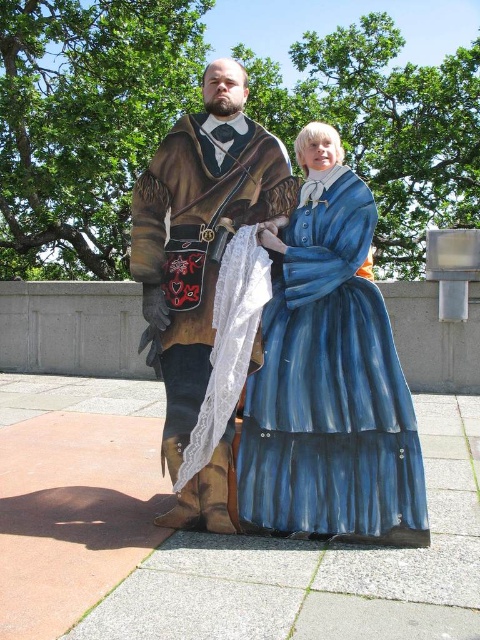
Question: Which point is farther from the camera taking this photo?

Choices:
 (A) (178, 172)
 (B) (296, 372)

Answer: (A)

Question: Does matte brown leather coat at center have a smaller size compared to brown leather robe at center?

Choices:
 (A) no
 (B) yes

Answer: (A)

Question: Considering the real-world distances, which object is closest to the blue satin dress at center?

Choices:
 (A) brown leather robe at center
 (B) matte brown leather coat at center

Answer: (B)

Question: Which point appears closest to the camera in this image?

Choices:
 (A) (320, 154)
 (B) (154, 362)

Answer: (A)

Question: Does matte brown leather coat at center lie in front of brown leather robe at center?

Choices:
 (A) yes
 (B) no

Answer: (A)

Question: Does matte brown leather coat at center have a greater width compared to blue satin dress at center?

Choices:
 (A) yes
 (B) no

Answer: (A)